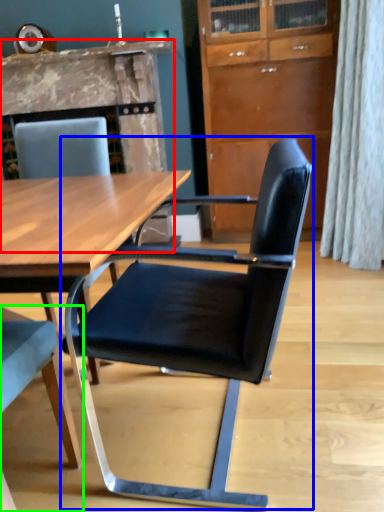
Question: Which is nearer to the fireplace (highlighted by a red box)? chair (highlighted by a blue box) or chair (highlighted by a green box).

Choices:
 (A) chair
 (B) chair

Answer: (A)